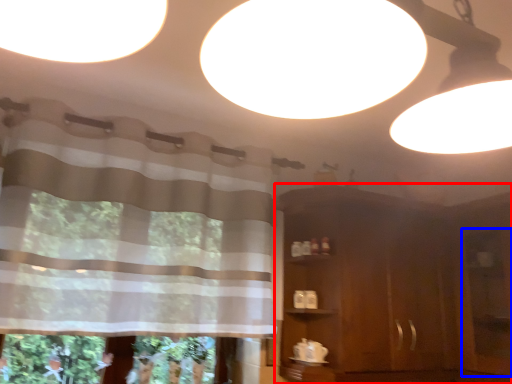
Question: Which object appears farthest to the camera in this image, dresser (highlighted by a red box) or screen door (highlighted by a blue box)?

Choices:
 (A) dresser
 (B) screen door

Answer: (A)